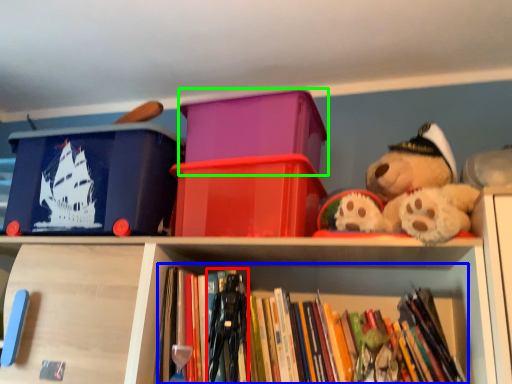
Question: Estimate the real-world distances between objects in this image. Which object is farther from toy (highlighted by a red box), book (highlighted by a blue box) or storage box (highlighted by a green box)?

Choices:
 (A) book
 (B) storage box

Answer: (B)